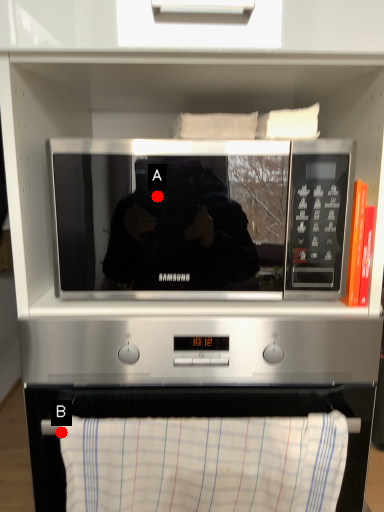
Question: Two points are circled on the image, labeled by A and B beside each circle. Which point appears closest to the camera in this image?

Choices:
 (A) A is closer
 (B) B is closer

Answer: (B)